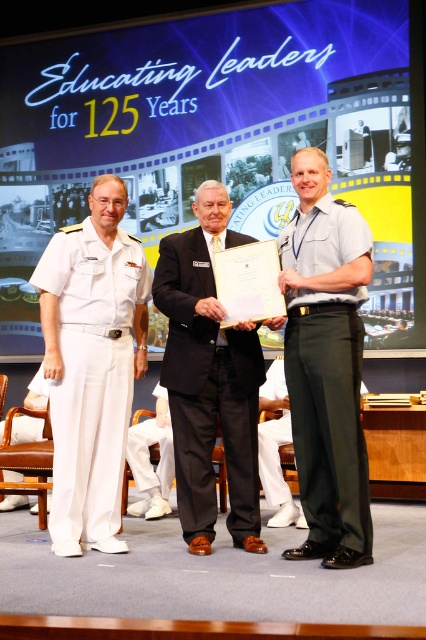
Does green cotton pants at center appear under white cotton pants at lower center?

No, green cotton pants at center is not below white cotton pants at lower center.

Who is more distant from viewer, (x=319, y=515) or (x=161, y=429)?

The point (x=161, y=429) is more distant.

Does point (350, 317) come in front of point (157, 470)?

Yes, point (350, 317) is closer to viewer.

Where is `green cotton pants at center`? This screenshot has height=640, width=426. green cotton pants at center is located at coordinates (328, 413).

Describe the element at coordinates (92, 372) in the screenshot. I see `white cotton pants at left` at that location.

Can you confirm if white cotton pants at left is thinner than green cotton pants at center?

Incorrect, white cotton pants at left's width is not less than green cotton pants at center's.

Is point (94, 465) closer to viewer compared to point (313, 452)?

No, it is behind (313, 452).

Identify the location of white cotton pants at left. (92, 372).

Does green cotton pants at center have a lesser width compared to black wool suit at center?

Yes, green cotton pants at center is thinner than black wool suit at center.

Which is below, green cotton pants at center or black wool suit at center?

black wool suit at center is lower down.

The width and height of the screenshot is (426, 640). What are the coordinates of `green cotton pants at center` in the screenshot? It's located at (328, 413).

The width and height of the screenshot is (426, 640). Identify the location of green cotton pants at center. (328, 413).